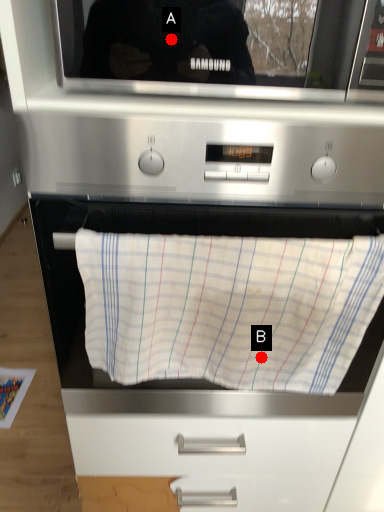
Question: Two points are circled on the image, labeled by A and B beside each circle. Among these points, which one is nearest to the camera?

Choices:
 (A) A is closer
 (B) B is closer

Answer: (A)